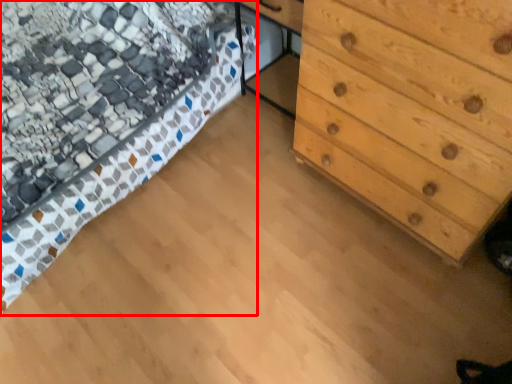
Question: From the image, what is the correct spatial relationship of bed (annotated by the red box) in relation to chest of drawers?

Choices:
 (A) left
 (B) right

Answer: (A)